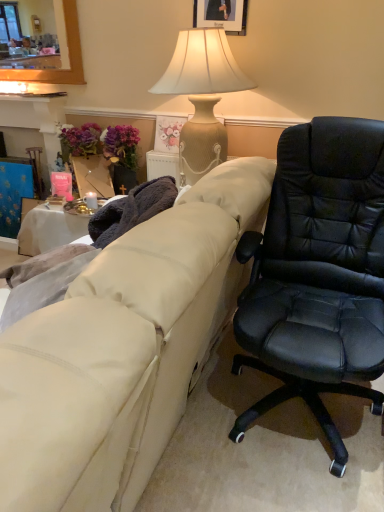
Question: From a real-world perspective, is wooden picture frame at upper center positioned under beige fabric couch at center based on gravity?

Choices:
 (A) yes
 (B) no

Answer: (B)

Question: Is wooden picture frame at upper center to the left of beige fabric couch at center from the viewer's perspective?

Choices:
 (A) yes
 (B) no

Answer: (B)

Question: Can we say wooden picture frame at upper center lies outside beige fabric couch at center?

Choices:
 (A) yes
 (B) no

Answer: (A)

Question: Is wooden picture frame at upper center thinner than beige fabric couch at center?

Choices:
 (A) no
 (B) yes

Answer: (B)

Question: Considering the relative sizes of wooden picture frame at upper center and beige fabric couch at center in the image provided, is wooden picture frame at upper center wider than beige fabric couch at center?

Choices:
 (A) no
 (B) yes

Answer: (A)

Question: Based on their sizes in the image, would you say beige textured lamp at upper center is bigger or smaller than wooden picture frame at upper center?

Choices:
 (A) small
 (B) big

Answer: (B)

Question: Considering the positions of point pos(185,88) and point pos(201,0), is point pos(185,88) closer or farther from the camera than point pos(201,0)?

Choices:
 (A) closer
 (B) farther

Answer: (A)

Question: Considering the positions of beige textured lamp at upper center and wooden picture frame at upper center in the image, is beige textured lamp at upper center taller or shorter than wooden picture frame at upper center?

Choices:
 (A) tall
 (B) short

Answer: (A)

Question: Is beige textured lamp at upper center in front of or behind wooden picture frame at upper center in the image?

Choices:
 (A) front
 (B) behind

Answer: (A)

Question: From the image's perspective, is wooden picture frame at upper center above or below beige fabric couch at center?

Choices:
 (A) above
 (B) below

Answer: (A)

Question: Is wooden picture frame at upper center situated inside beige fabric couch at center or outside?

Choices:
 (A) inside
 (B) outside

Answer: (B)

Question: From a real-world perspective, is wooden picture frame at upper center physically located above or below beige fabric couch at center?

Choices:
 (A) above
 (B) below

Answer: (A)

Question: In terms of size, does wooden picture frame at upper center appear bigger or smaller than beige fabric couch at center?

Choices:
 (A) small
 (B) big

Answer: (A)

Question: In terms of width, does beige fabric couch at center look wider or thinner when compared to purple fabric at left?

Choices:
 (A) thin
 (B) wide

Answer: (B)

Question: Considering the positions of beige fabric couch at center and purple fabric at left in the image, is beige fabric couch at center taller or shorter than purple fabric at left?

Choices:
 (A) tall
 (B) short

Answer: (A)